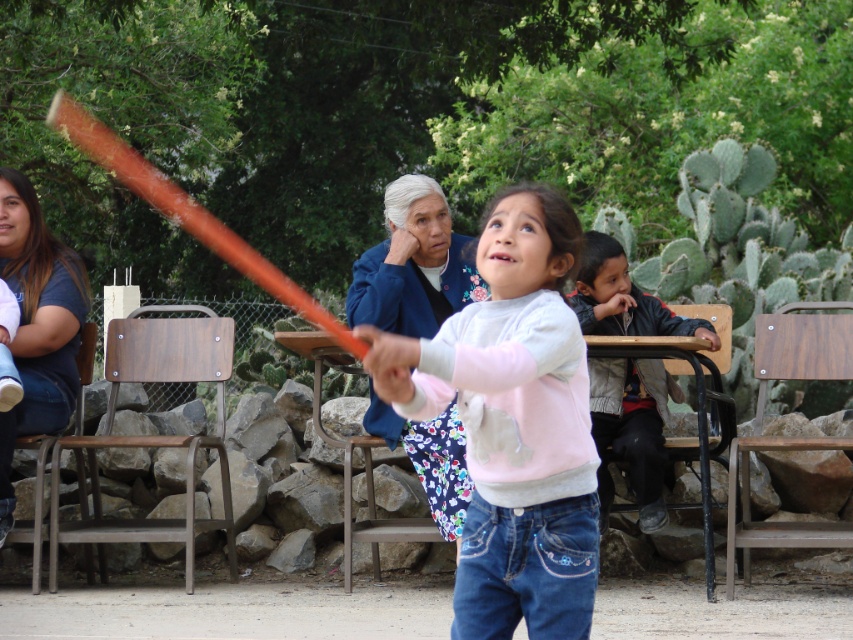
You are a photographer trying to capture a photo of the matte pink sweater at center and the dark gray jacket at right. Which one should you zoom in on to make them appear the same size in the photo?

The matte pink sweater at center is smaller than the dark gray jacket at right, so you should zoom in on the matte pink sweater at center to make them appear the same size in the photo.